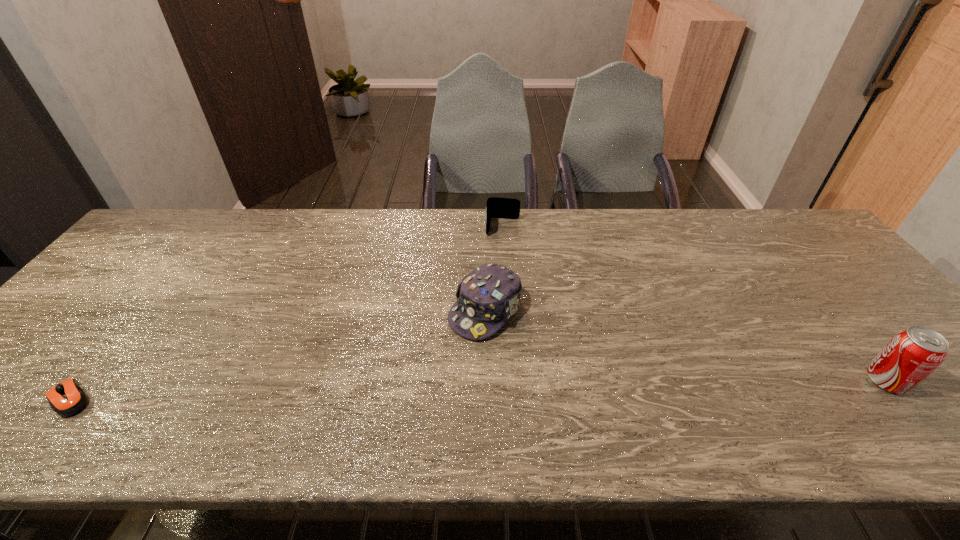
Where is `blank area located on the outer surface of the wallet`? The image size is (960, 540). blank area located on the outer surface of the wallet is located at coordinates (499, 285).

Where is `free location located on the outer surface of the wallet`? The image size is (960, 540). free location located on the outer surface of the wallet is located at coordinates (501, 247).

Locate an element on the screen. free region located 0.240m on the outer surface of the wallet is located at coordinates (499, 289).

I want to click on free location located 0.230m on the front-facing side of the third shortest object, so click(400, 405).

At what (x,y) coordinates should I click in order to perform the action: click on vacant area located 0.050m on the front-facing side of the third shortest object. Please return your answer as a coordinate pair (x, y). The image size is (960, 540). Looking at the image, I should click on pos(451,350).

Locate an element on the screen. blank space located 0.050m on the front-facing side of the third shortest object is located at coordinates (451, 350).

Identify the location of object located at the far edge. (506, 208).

Find the location of `computer mouse at the near edge`. computer mouse at the near edge is located at coordinates (67, 398).

The height and width of the screenshot is (540, 960). What are the coordinates of `soda present at the near edge` in the screenshot? It's located at (913, 354).

The width and height of the screenshot is (960, 540). I want to click on object located at the left edge, so click(67, 398).